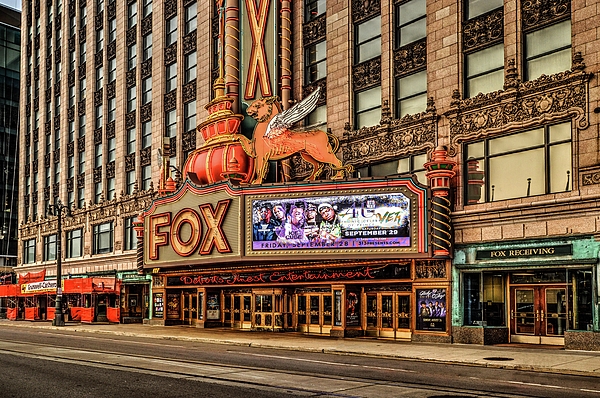
Find the location of a particular element. The height and width of the screenshot is (398, 600). door is located at coordinates (524, 317).